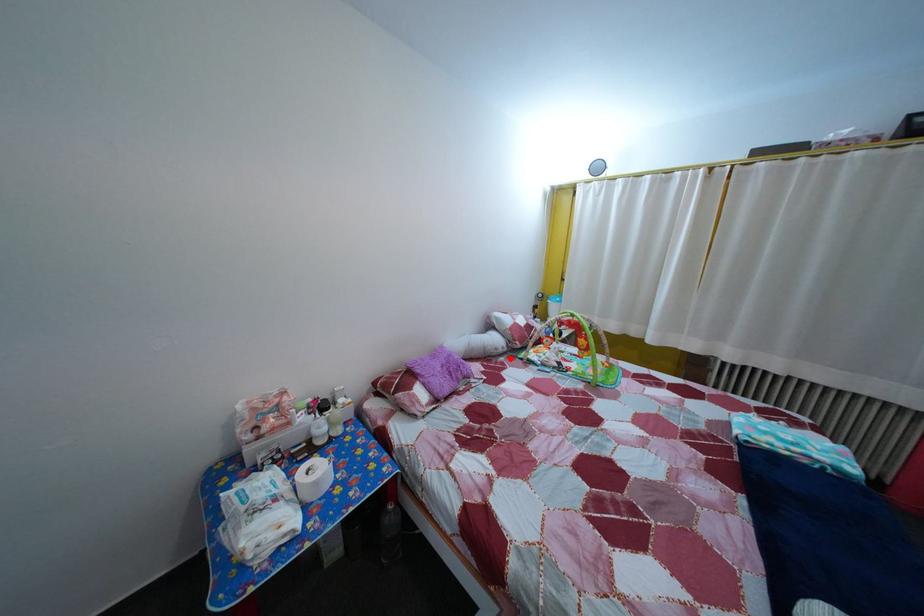
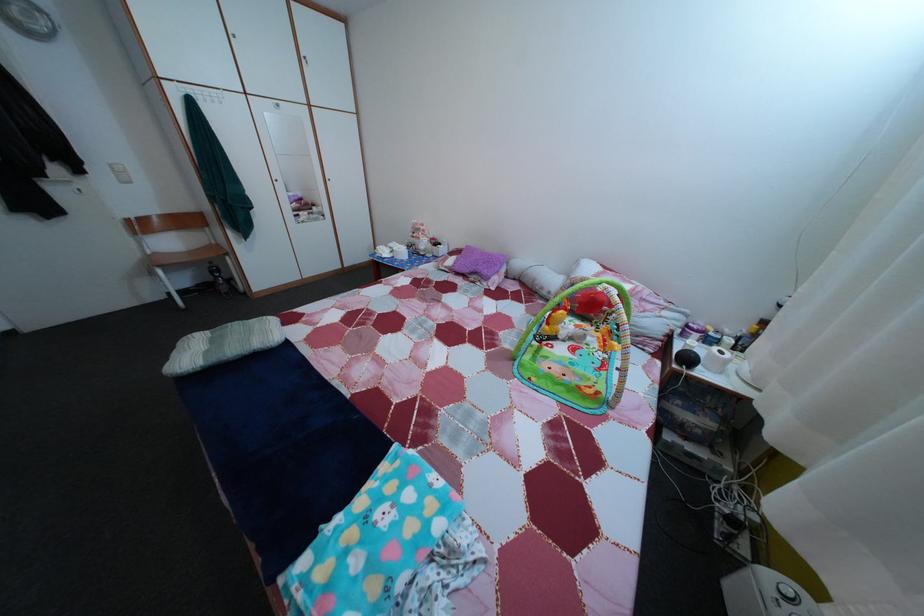
In the second image, find the point that corresponds to the highlighted location in the first image.

(553, 301)